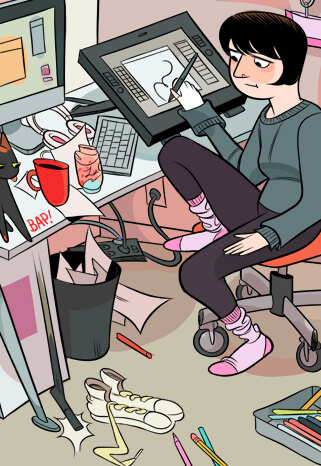
Locate an element on the screen. electrical outlet is located at coordinates point(156,184).